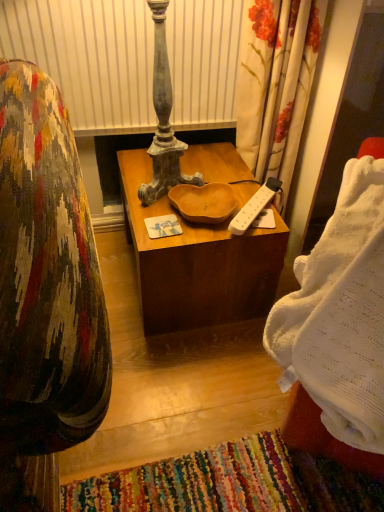
The image size is (384, 512). In order to click on vacant space situated above wooden at center (from a real-world perspective) in this screenshot , I will do [x=189, y=168].